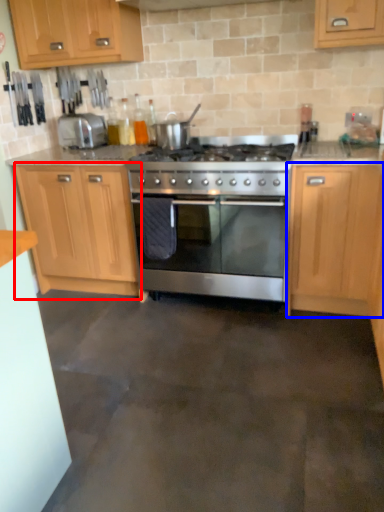
Question: Which object appears closest to the camera in this image, cabinetry (highlighted by a red box) or cabinetry (highlighted by a blue box)?

Choices:
 (A) cabinetry
 (B) cabinetry

Answer: (B)